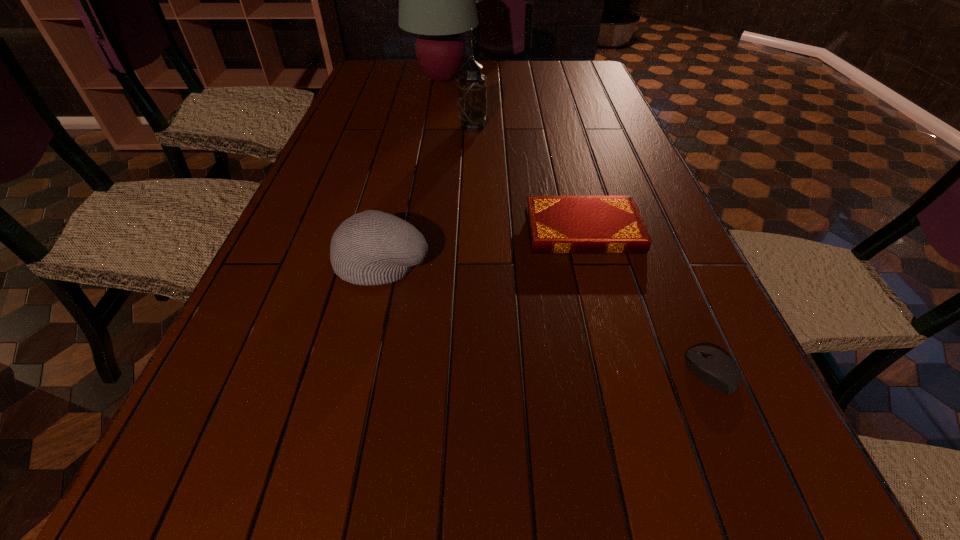
Where is `free space that satisfies the following two spatial constraints: 1. on the cover of the hardback book; 2. on the right side of the nearest object`? free space that satisfies the following two spatial constraints: 1. on the cover of the hardback book; 2. on the right side of the nearest object is located at coordinates (620, 372).